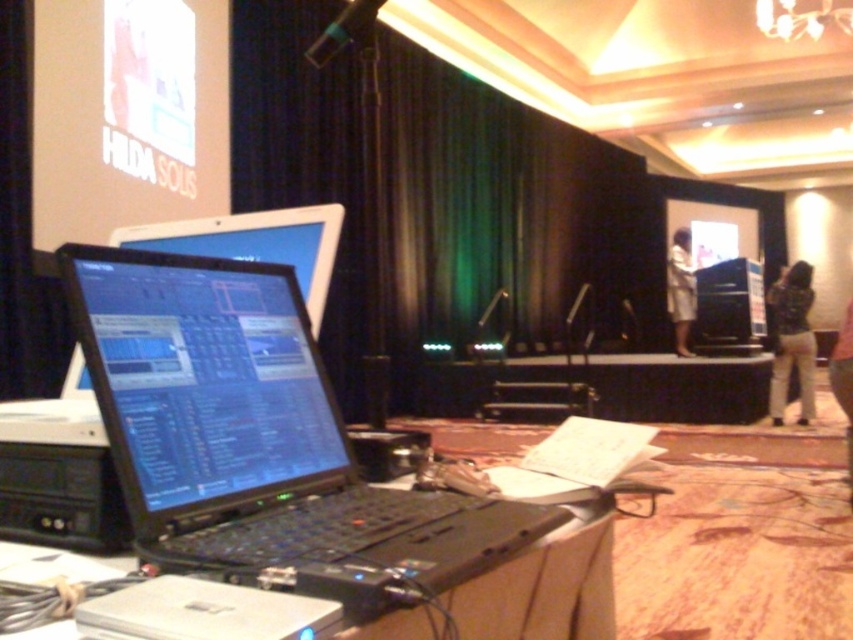
Does black plastic laptop at center have a lesser height compared to tan fabric pants at lower right?

Indeed, black plastic laptop at center has a lesser height compared to tan fabric pants at lower right.

What do you see at coordinates (258, 440) in the screenshot? The width and height of the screenshot is (853, 640). I see `black plastic laptop at center` at bounding box center [258, 440].

Is point (219, 538) behind point (850, 349)?

That is False.

Where is `black plastic laptop at center`? black plastic laptop at center is located at coordinates (258, 440).

Is white glossy projection screen at upper left below tan fabric pants at lower right?

No.

Find the location of a particular element. The image size is (853, 640). white glossy projection screen at upper left is located at coordinates (126, 115).

Identify the location of tan fabric pants at lower right. Image resolution: width=853 pixels, height=640 pixels. coord(843,378).

The height and width of the screenshot is (640, 853). In order to click on tan fabric pants at lower right in this screenshot , I will do point(843,378).